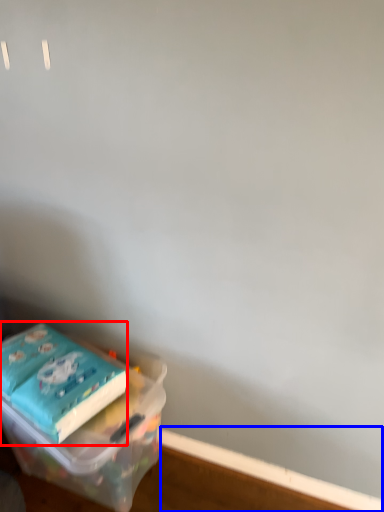
Question: Which object appears farthest to the camera in this image, paperback book (highlighted by a red box) or window sill (highlighted by a blue box)?

Choices:
 (A) paperback book
 (B) window sill

Answer: (B)